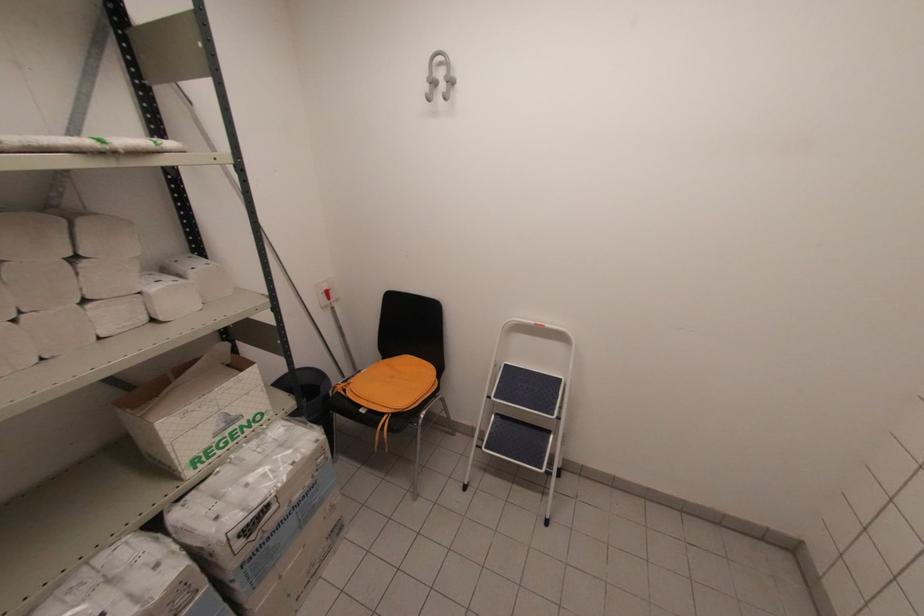
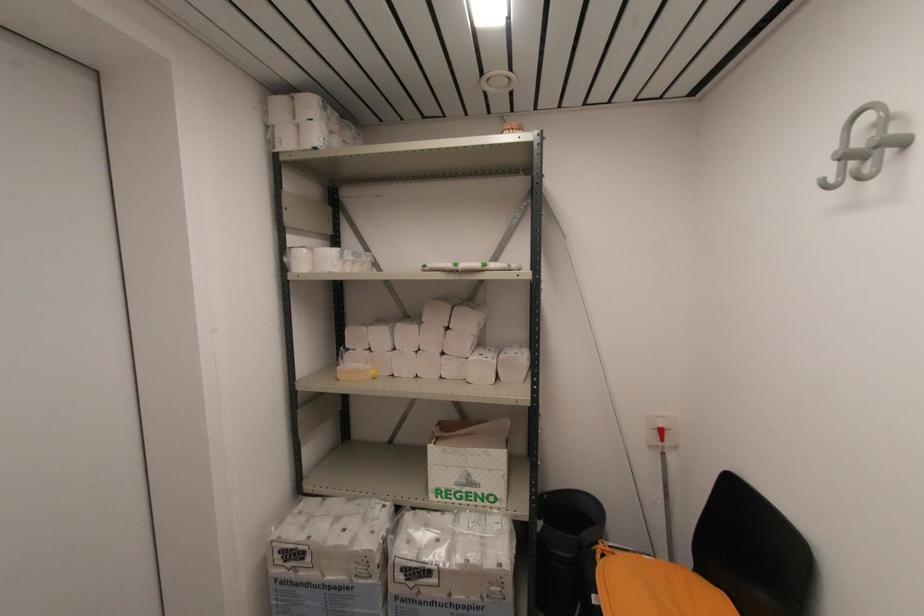
The point at (224, 426) is marked in the first image. Where is the corresponding point in the second image?

(465, 480)